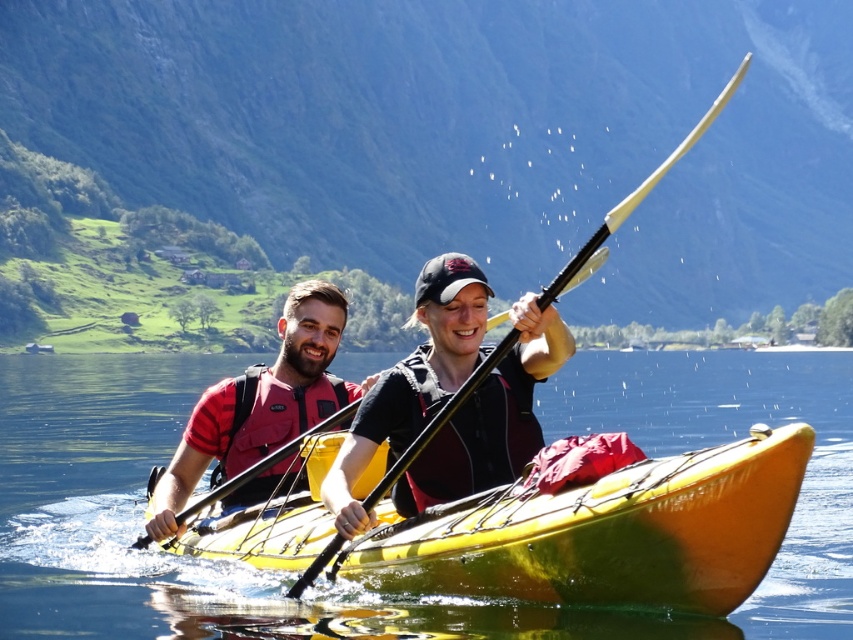
Question: Estimate the real-world distances between objects in this image. Which object is farther from the red matte life vest at left?

Choices:
 (A) black matte paddle at center
 (B) yellow glossy canoe at center

Answer: (A)

Question: Is red matte life vest at left above black matte paddle at center?

Choices:
 (A) yes
 (B) no

Answer: (B)

Question: Can you confirm if red matte life vest at left is bigger than black matte paddle at center?

Choices:
 (A) yes
 (B) no

Answer: (B)

Question: Which point appears closest to the camera in this image?

Choices:
 (A) (653, 177)
 (B) (387, 381)

Answer: (B)

Question: Can you confirm if red matte life vest at left is positioned to the right of black matte paddle at center?

Choices:
 (A) yes
 (B) no

Answer: (B)

Question: Among these points, which one is farthest from the camera?

Choices:
 (A) (630, 544)
 (B) (236, 440)

Answer: (B)